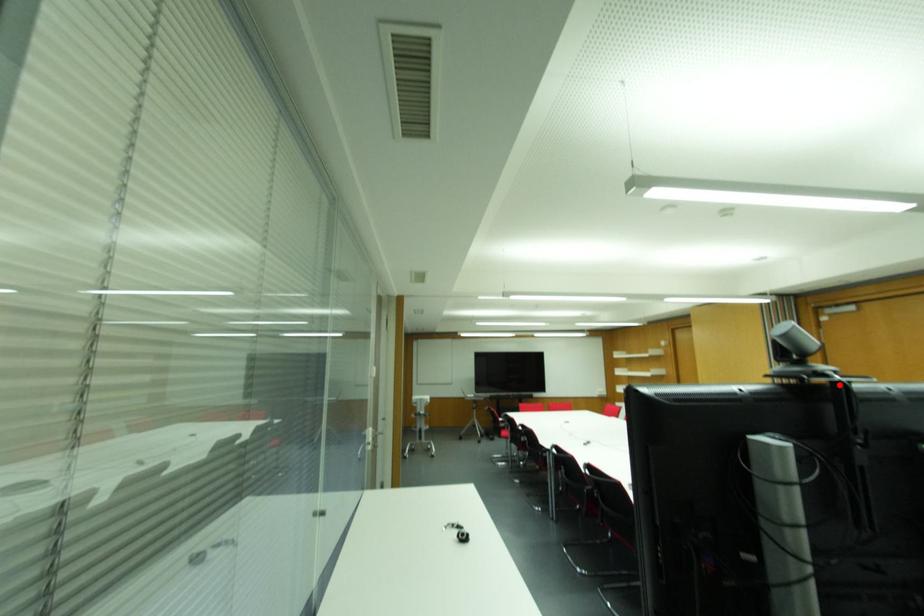
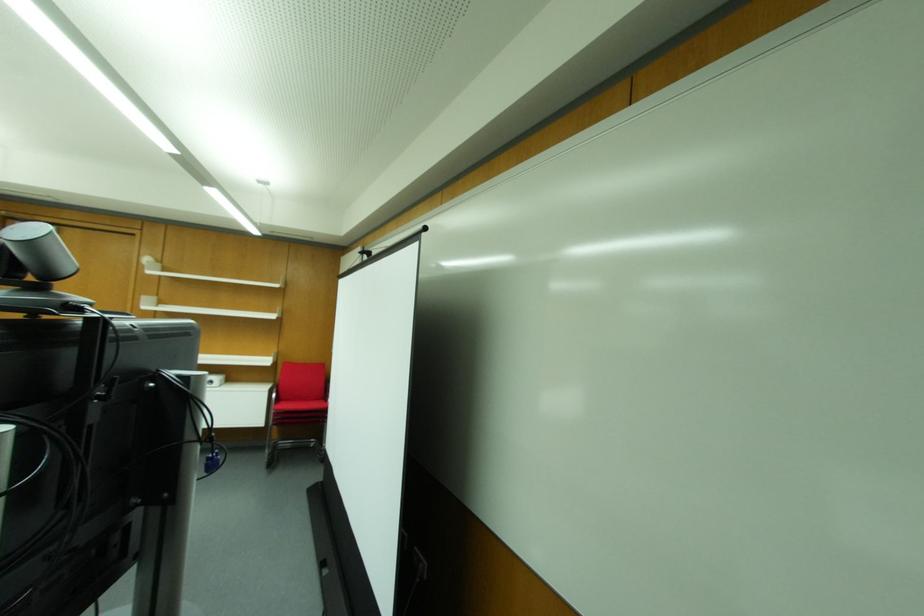
In the second image, find the point that corresponds to the highlighted location in the first image.

(98, 323)